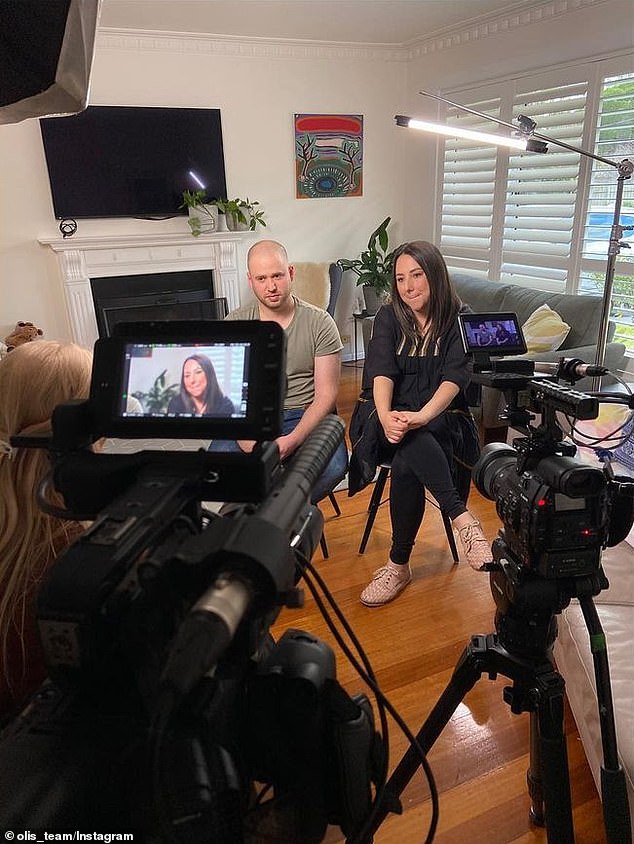
This screenshot has height=844, width=634. I want to click on tv, so click(x=146, y=202).